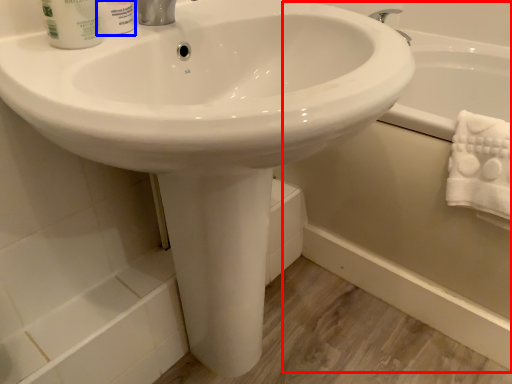
Question: Which of the following is the closest to the observer, bath (highlighted by a red box) or shaving cream (highlighted by a blue box)?

Choices:
 (A) bath
 (B) shaving cream

Answer: (B)